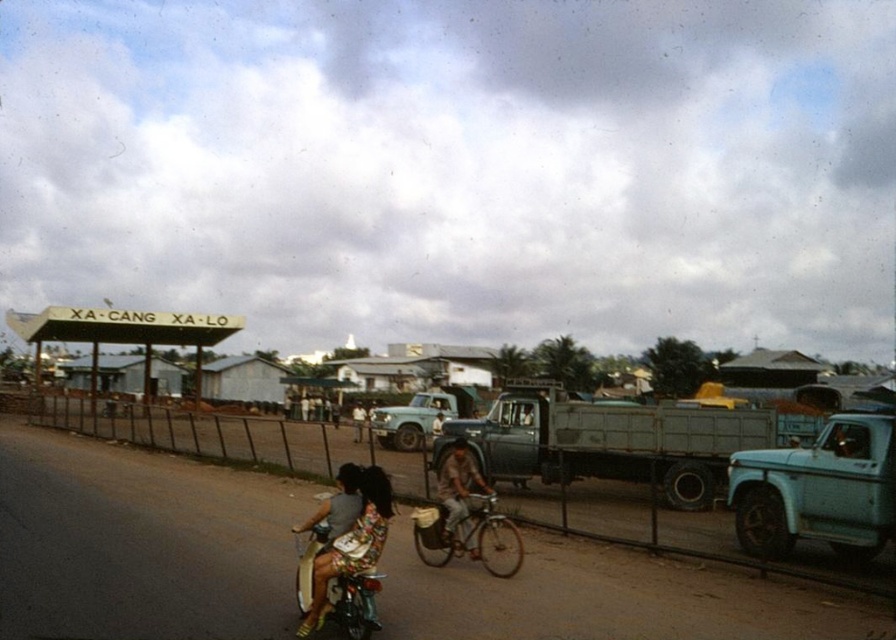
Question: Does brown dirt track at center have a greater width compared to light blue metallic truck at center?

Choices:
 (A) no
 (B) yes

Answer: (B)

Question: Which point is closer to the camera taking this photo?

Choices:
 (A) [737, 538]
 (B) [369, 616]
 (C) [470, 534]
 (D) [130, 474]

Answer: (B)

Question: Which point appears closest to the camera in this image?

Choices:
 (A) (506, 545)
 (B) (438, 404)
 (C) (886, 476)

Answer: (C)

Question: Which object appears farthest from the camera in this image?

Choices:
 (A) light brown wooden bicycle at center
 (B) light blue metallic truck at center
 (C) light blue metallic truck at right

Answer: (B)

Question: Can you confirm if light blue metallic truck at center is positioned to the left of light brown wooden bicycle at center?

Choices:
 (A) no
 (B) yes

Answer: (B)

Question: Can you confirm if brown dirt track at center is positioned below metallic silver bicycle at center?

Choices:
 (A) no
 (B) yes

Answer: (B)